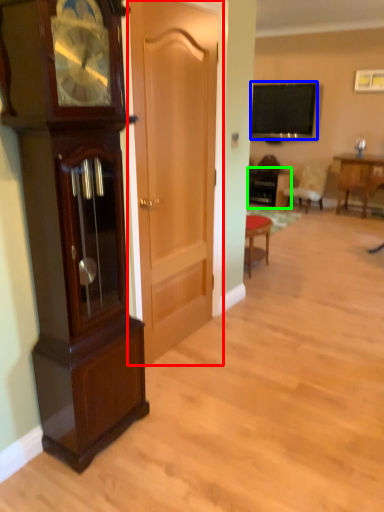
Question: Estimate the real-world distances between objects in this image. Which object is farther from door (highlighted by a red box), television (highlighted by a blue box) or table (highlighted by a green box)?

Choices:
 (A) television
 (B) table

Answer: (A)